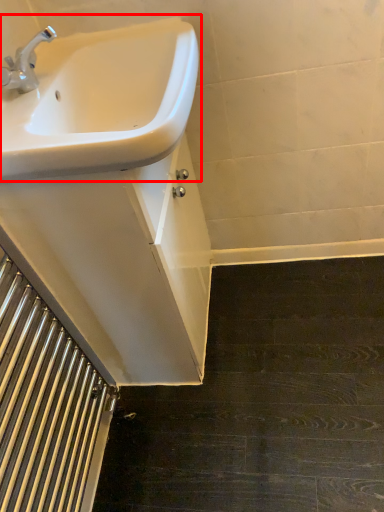
Question: From the image's perspective, what is the correct spatial relationship of sink (annotated by the red box) in relation to stairwell?

Choices:
 (A) below
 (B) above

Answer: (B)